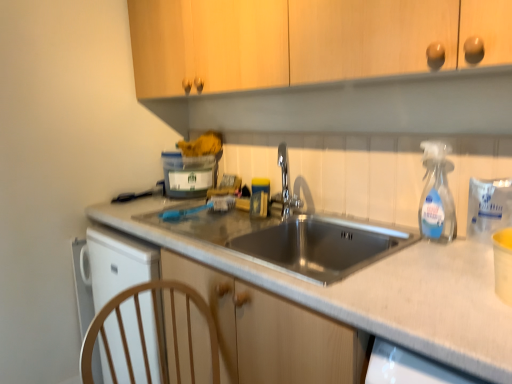
Question: Is chrome metallic faucet at center beside translucent plastic container at upper center?

Choices:
 (A) yes
 (B) no

Answer: (B)

Question: Would you say chrome metallic faucet at center is a long distance from translucent plastic container at upper center?

Choices:
 (A) yes
 (B) no

Answer: (B)

Question: Can you confirm if chrome metallic faucet at center is bigger than translucent plastic container at upper center?

Choices:
 (A) no
 (B) yes

Answer: (A)

Question: Can we say chrome metallic faucet at center lies outside translucent plastic container at upper center?

Choices:
 (A) yes
 (B) no

Answer: (A)

Question: Is the position of chrome metallic faucet at center more distant than that of translucent plastic container at upper center?

Choices:
 (A) no
 (B) yes

Answer: (A)

Question: Can you confirm if chrome metallic faucet at center is thinner than translucent plastic container at upper center?

Choices:
 (A) yes
 (B) no

Answer: (A)

Question: Considering the relative sizes of chrome metallic faucet at center and metallic gray sink at center in the image provided, is chrome metallic faucet at center shorter than metallic gray sink at center?

Choices:
 (A) no
 (B) yes

Answer: (B)

Question: From the image's perspective, is chrome metallic faucet at center over metallic gray sink at center?

Choices:
 (A) yes
 (B) no

Answer: (A)

Question: Does chrome metallic faucet at center appear on the right side of metallic gray sink at center?

Choices:
 (A) no
 (B) yes

Answer: (A)

Question: Is chrome metallic faucet at center positioned with its back to metallic gray sink at center?

Choices:
 (A) no
 (B) yes

Answer: (A)

Question: Is chrome metallic faucet at center wider than metallic gray sink at center?

Choices:
 (A) no
 (B) yes

Answer: (A)

Question: From a real-world perspective, is chrome metallic faucet at center located beneath metallic gray sink at center?

Choices:
 (A) yes
 (B) no

Answer: (B)

Question: From the image's perspective, would you say chrome metallic faucet at center is shown under clear plastic spray bottle at right?

Choices:
 (A) yes
 (B) no

Answer: (B)